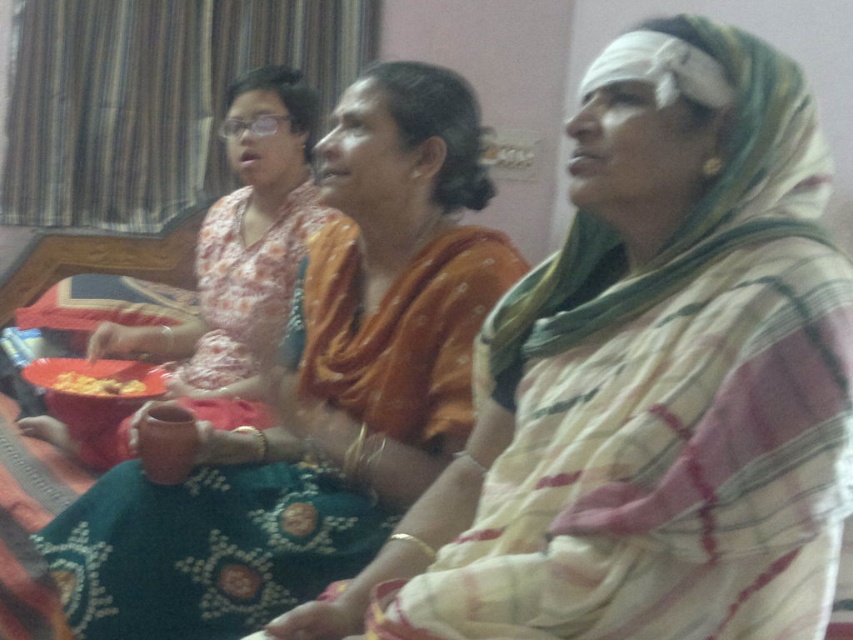
Question: Which object is farther from the camera taking this photo?

Choices:
 (A) yellow crispy snack at lower left
 (B) matte brown bowl at center
 (C) matte orange bowl at center
 (D) matte orange sari at center

Answer: (A)

Question: Is matte orange sari at center further to camera compared to matte brown bowl at center?

Choices:
 (A) yes
 (B) no

Answer: (B)

Question: Where is matte brown bowl at center located in relation to yellow crispy snack at lower left in the image?

Choices:
 (A) above
 (B) below

Answer: (A)

Question: Estimate the real-world distances between objects in this image. Which object is closer to the matte orange bowl at center?

Choices:
 (A) yellow crispy snack at lower left
 (B) matte orange sari at center

Answer: (A)

Question: Which of these objects is positioned farthest from the yellow crispy snack at lower left?

Choices:
 (A) matte orange sari at center
 (B) matte orange bowl at center
 (C) matte brown bowl at center

Answer: (A)

Question: Can you confirm if matte orange sari at center is positioned to the left of yellow crispy snack at lower left?

Choices:
 (A) no
 (B) yes

Answer: (A)